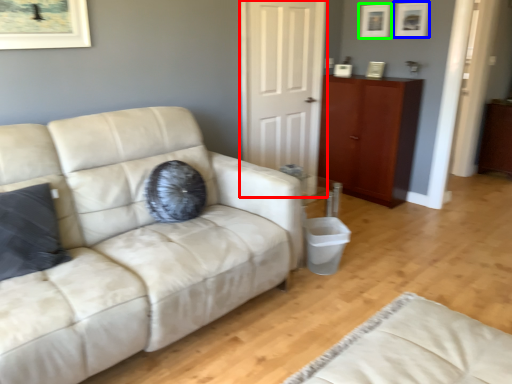
Question: Estimate the real-world distances between objects in this image. Which object is farther from door (highlighted by a red box), picture frame (highlighted by a blue box) or picture frame (highlighted by a green box)?

Choices:
 (A) picture frame
 (B) picture frame

Answer: (A)